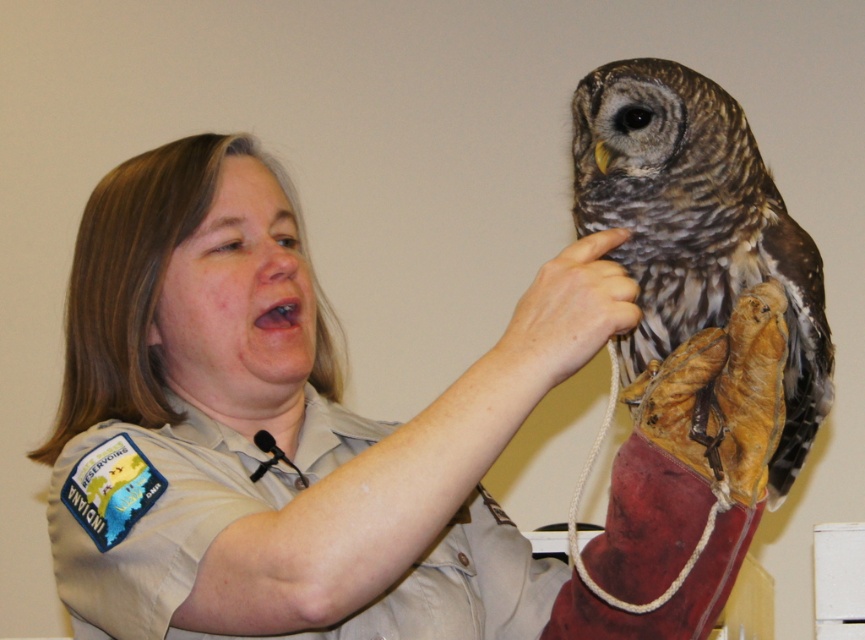
You are a wildlife photographer trying to capture a closeup shot of the owl. You need to focus on the brown speckled feathers at upper right and ensure the brown leather glove at upper center is also in the frame. Can you fit both in your camera viewfinder if the maximum distance your lens can handle is 5 inches?

The brown speckled feathers at upper right and brown leather glove at upper center are 5.48 inches apart from each other. Since the distance exceeds the 5 inch limit, you cannot fit both in the frame.

You are a photographer trying to capture a clear shot of the light brown uniform at center and the brown speckled feathers at upper right. If your camera lens has a maximum focus range of 8 inches, will you be able to capture both subjects in focus at the same time?

The light brown uniform at center and brown speckled feathers at upper right are 8.52 inches apart from each other. Since the distance between them exceeds the camera lens maximum focus range of 8 inches, you won